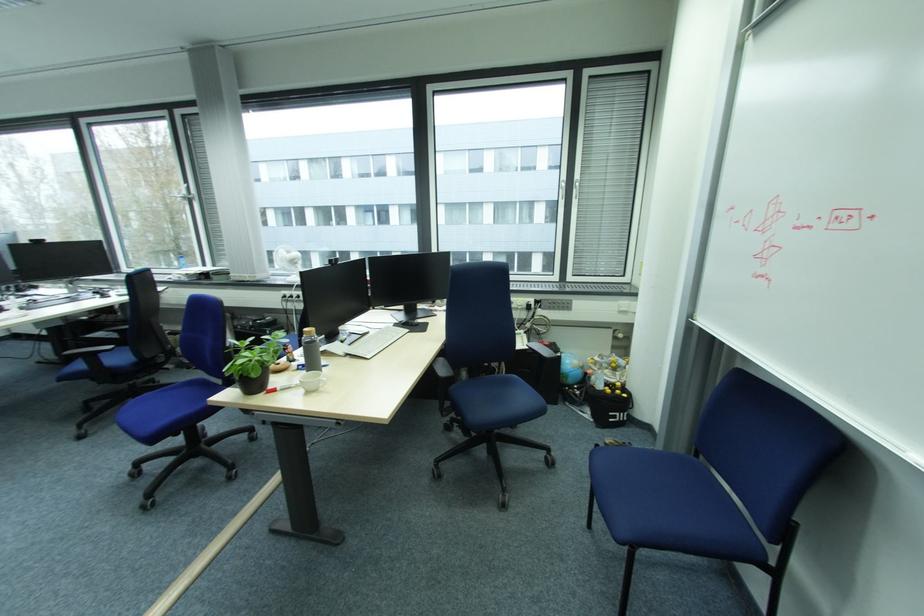
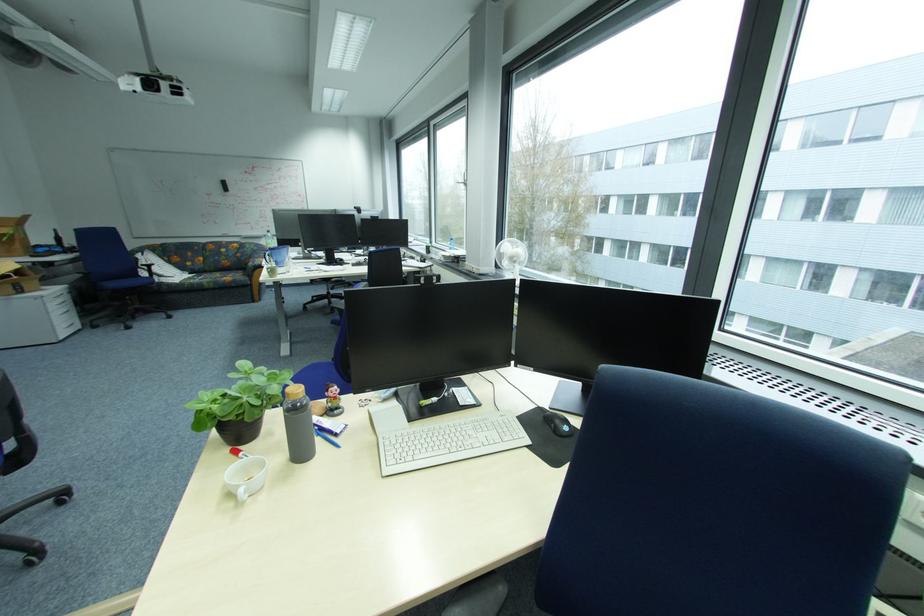
In the second image, find the point that corresponds to [418,326] in the first image.

(560, 428)